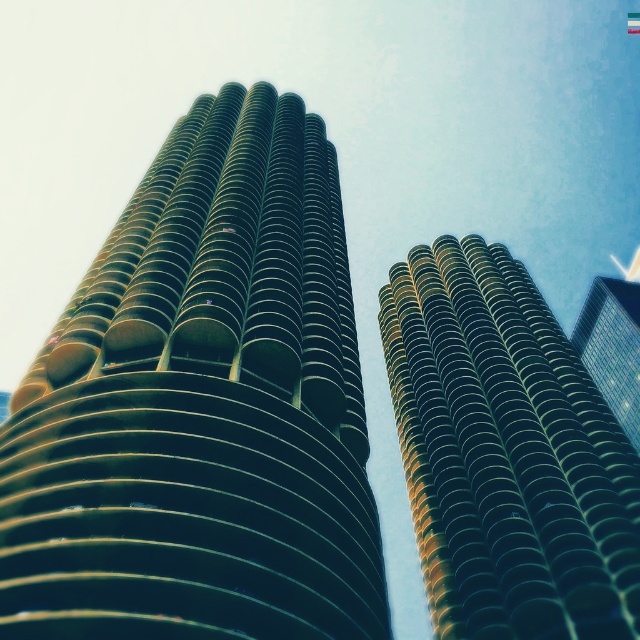
Question: Observing the image, what is the correct spatial positioning of green matte tower at center in reference to green glass skyscraper at right?

Choices:
 (A) right
 (B) left

Answer: (B)

Question: Which of the following is the farthest from the observer?

Choices:
 (A) (595, 362)
 (B) (218, 524)

Answer: (A)

Question: Which object appears closest to the camera in this image?

Choices:
 (A) green matte tower at center
 (B) green glass building at center

Answer: (A)

Question: Can you confirm if green matte tower at center is thinner than green glass skyscraper at right?

Choices:
 (A) no
 (B) yes

Answer: (B)

Question: Which object is closer to the camera taking this photo?

Choices:
 (A) green glass building at center
 (B) green matte tower at center
 (C) green glass skyscraper at right

Answer: (B)

Question: Can you confirm if green glass building at center is positioned to the left of green glass skyscraper at right?

Choices:
 (A) yes
 (B) no

Answer: (A)